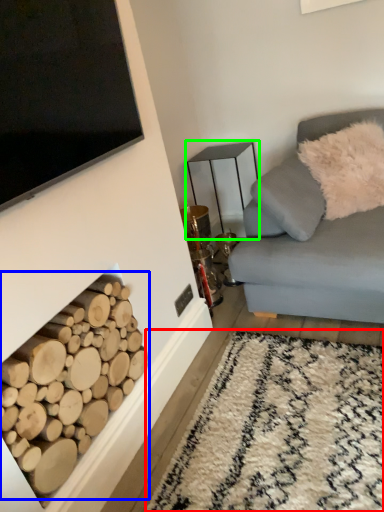
Question: Which object is the farthest from plain (highlighted by a red box)? Choose among these: driftwood (highlighted by a blue box) or table (highlighted by a green box).

Choices:
 (A) driftwood
 (B) table

Answer: (B)